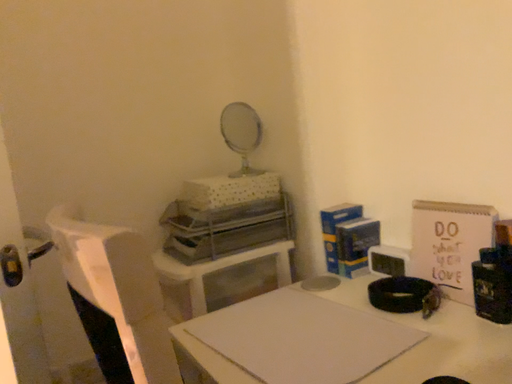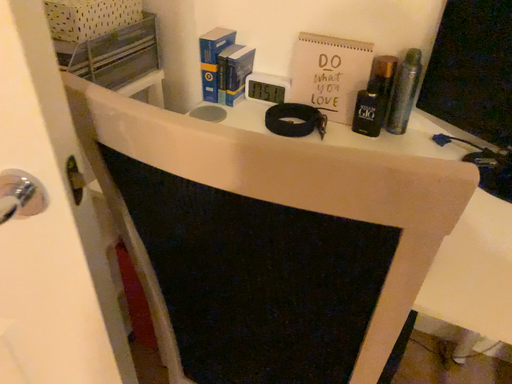
Question: How did the camera likely rotate when shooting the video?

Choices:
 (A) rotated right
 (B) rotated left

Answer: (A)